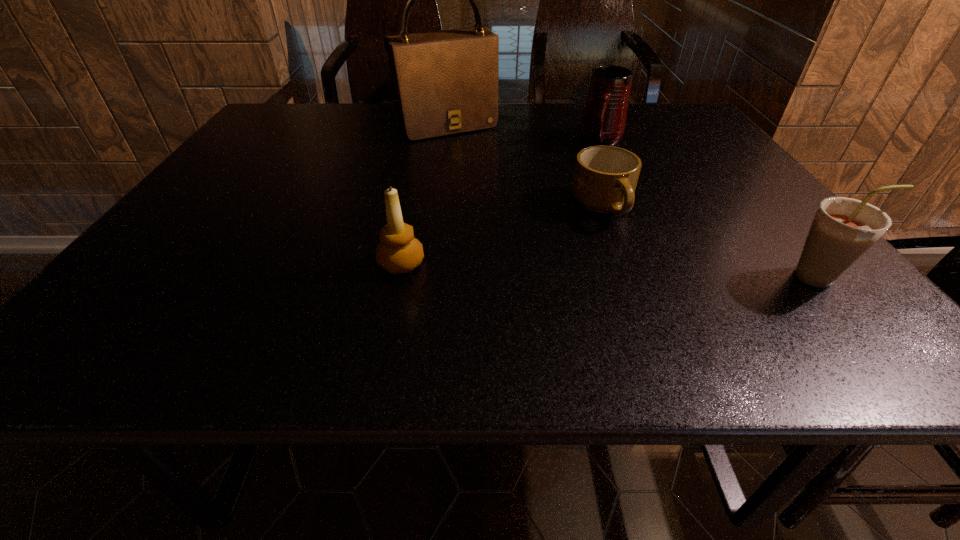
Where is `vacant space situated on the side with the handle of the third farthest object`? vacant space situated on the side with the handle of the third farthest object is located at coordinates (623, 255).

This screenshot has height=540, width=960. Find the location of `free space located 0.080m on the side with the handle of the third farthest object`. free space located 0.080m on the side with the handle of the third farthest object is located at coordinates (623, 255).

The image size is (960, 540). I want to click on free region located 0.340m on the front flap of the shoulder bag, so click(516, 204).

In order to click on free location located 0.350m on the front flap of the shoulder bag in this screenshot , I will do `click(517, 206)`.

Locate an element on the screen. blank space located on the front flap of the shoulder bag is located at coordinates (492, 175).

Where is `mug present at the far edge`? mug present at the far edge is located at coordinates (603, 120).

At what (x,y) coordinates should I click in order to perform the action: click on shoulder bag located at the far edge. Please return your answer as a coordinate pair (x, y). The width and height of the screenshot is (960, 540). Looking at the image, I should click on (445, 82).

Find the location of `candle_holder that is positioned at the near edge`. candle_holder that is positioned at the near edge is located at coordinates (398, 252).

Identify the location of root beer located at the near edge. The width and height of the screenshot is (960, 540). (844, 229).

I want to click on object located in the right edge section of the desktop, so click(844, 229).